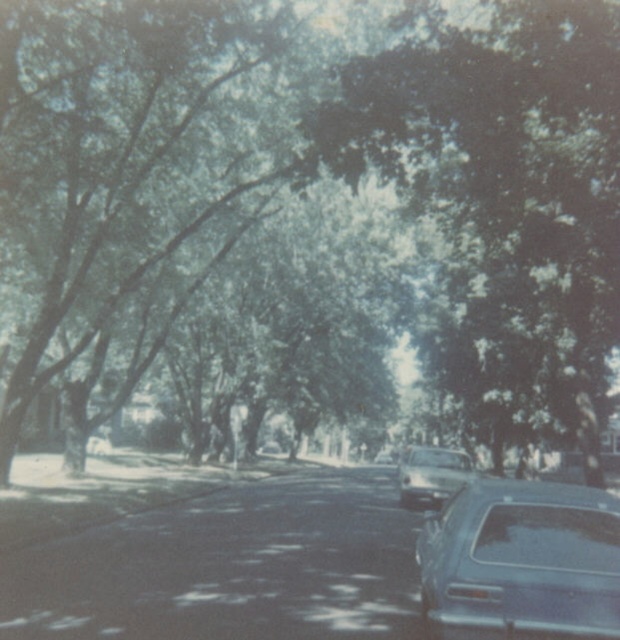
Question: Can you confirm if green leafy tree at center is positioned to the left of shiny blue sedan at lower right?

Choices:
 (A) no
 (B) yes

Answer: (A)

Question: Among these points, which one is farthest from the camera?

Choices:
 (A) (434, 472)
 (B) (523, 394)
 (C) (560, 572)

Answer: (B)

Question: Which is nearer to the shiny blue sedan at lower right?

Choices:
 (A) green leafy tree at center
 (B) shiny silver car at center

Answer: (A)

Question: Is green leafy tree at center thinner than shiny blue sedan at lower right?

Choices:
 (A) yes
 (B) no

Answer: (B)

Question: Considering the real-world distances, which object is closest to the shiny silver car at center?

Choices:
 (A) green leafy tree at center
 (B) shiny blue sedan at lower right

Answer: (A)

Question: Is shiny blue sedan at lower right below shiny silver car at center?

Choices:
 (A) no
 (B) yes

Answer: (A)